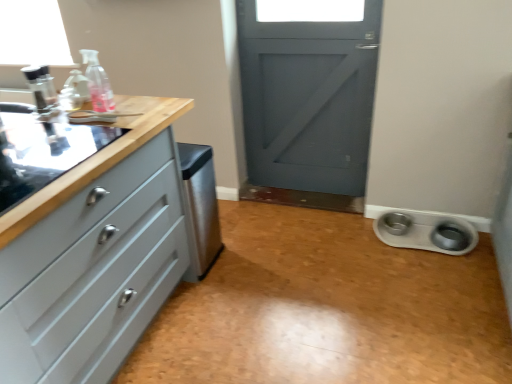
Where is `free spot in front of satin stainless steel dishwasher at center`? free spot in front of satin stainless steel dishwasher at center is located at coordinates (202, 294).